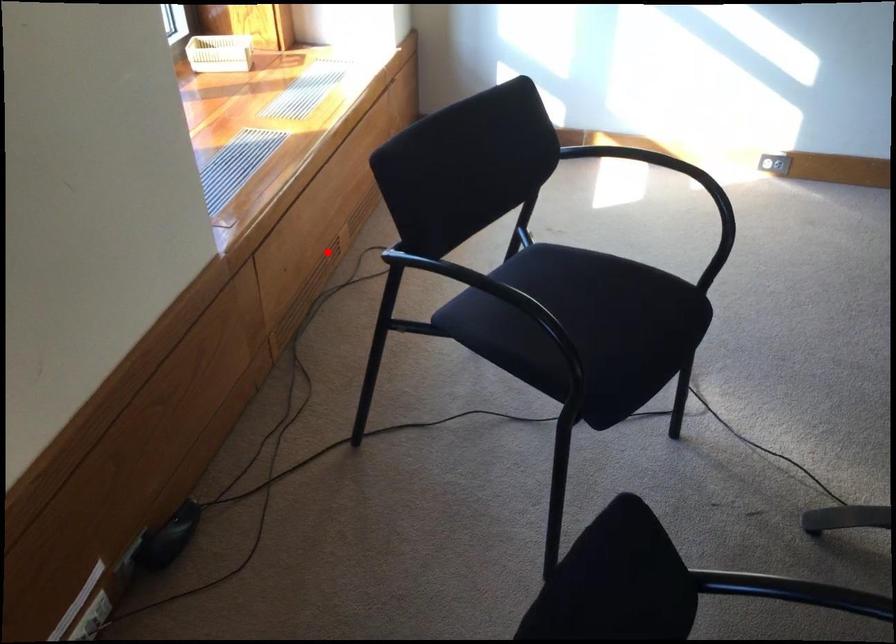
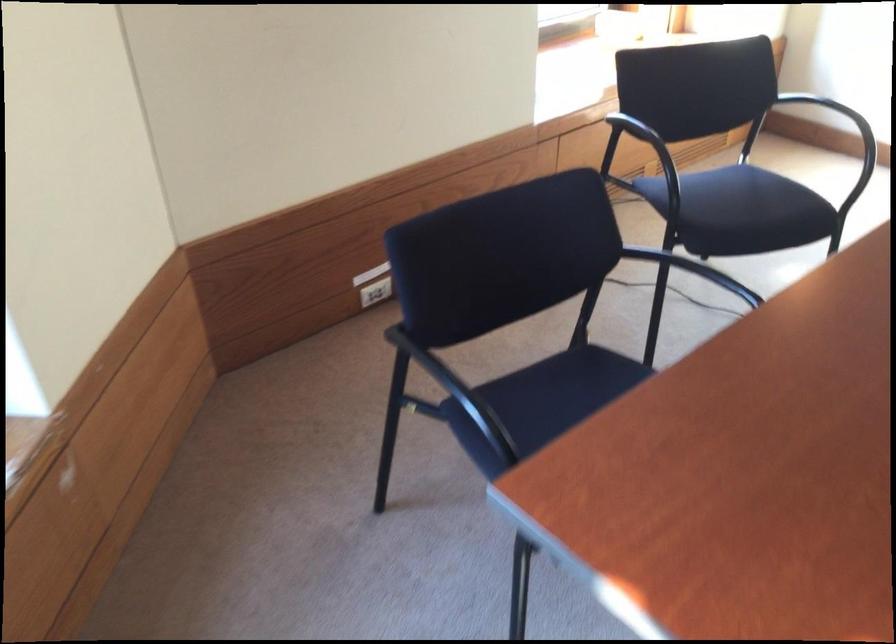
Question: I am providing you with two images of the same scene from different viewpoints. In image1, a red point is highlighted. Considering the same 3D point in image2, which of the following is correct?

Choices:
 (A) It is closer
 (B) It is farther

Answer: (B)